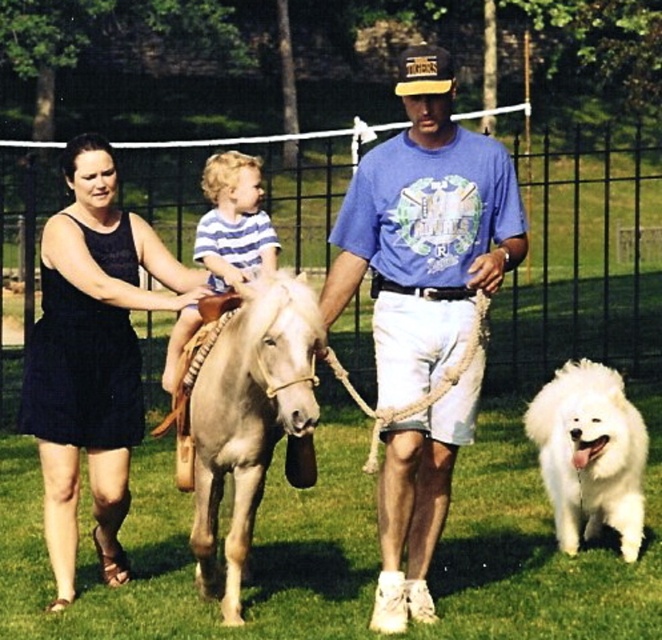
You are a photographer standing at the center of the scene. You want to take a photo of the striped cotton shirt at center and the white fluffy dog at lower right. Can you fit both subjects into your camera frame if your camera has a maximum horizontal field of view of 2 meters?

The distance between the striped cotton shirt at center and the white fluffy dog at lower right is 2.24 meters, which exceeds the camera frame of 2 meters. Therefore, both subjects cannot be captured in a single frame.

Where is the blue cotton shirt at center located in the image?

The blue cotton shirt at center is located at point 0.362 on the x axis and 0.642 on the y axis.

Looking at this image, you are a photographer trying to capture a photo of the blue cotton shirt at center and the white fluffy dog at lower right. Which object should you focus on first if you want to include both in the frame without moving the camera?

The blue cotton shirt at center is larger in size than the white fluffy dog at lower right, so you should focus on the blue cotton shirt at center first to ensure it fits properly in the frame.